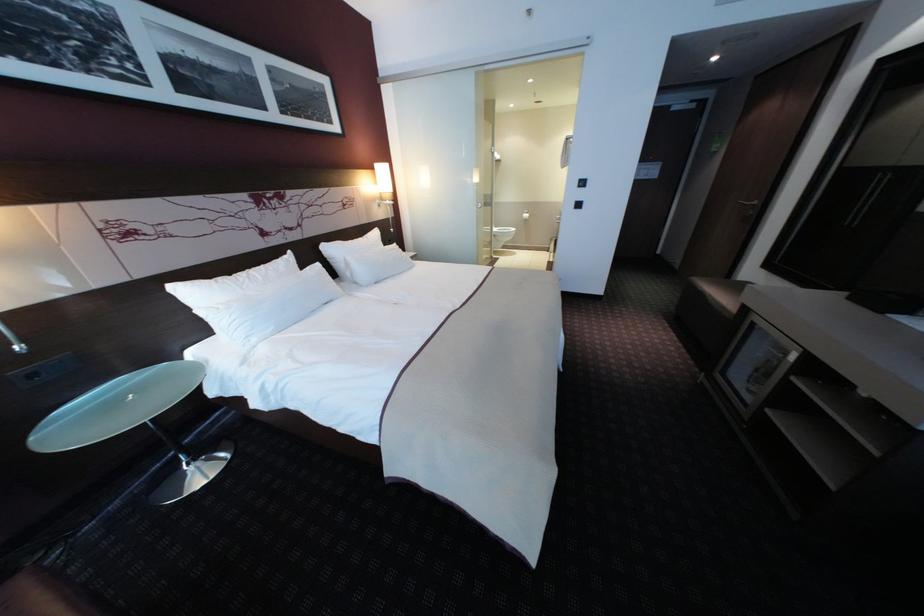
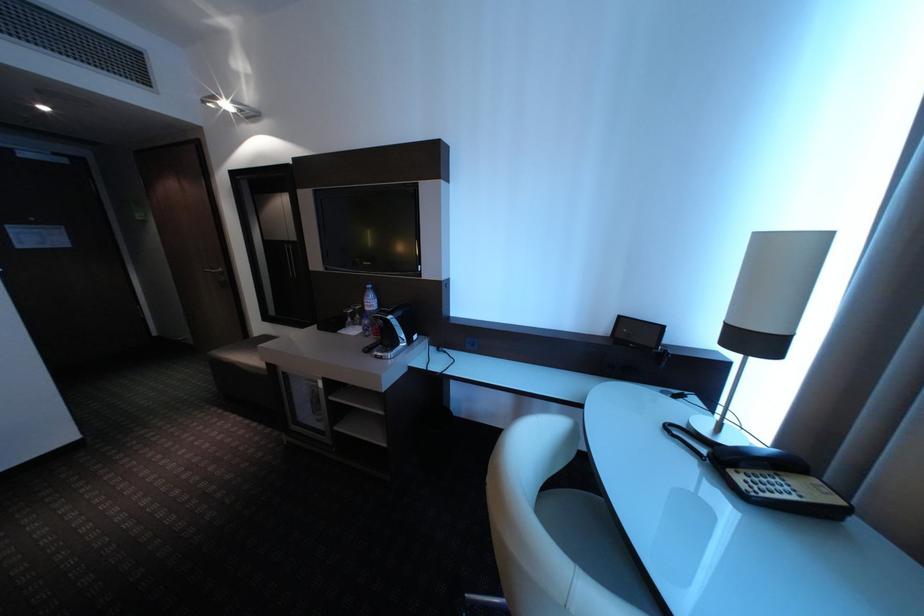
Question: Based on the continuous images, in which direction is the camera rotating? Reply with the corresponding letter.

Choices:
 (A) Left
 (B) Right
 (C) Up
 (D) Down

Answer: (B)